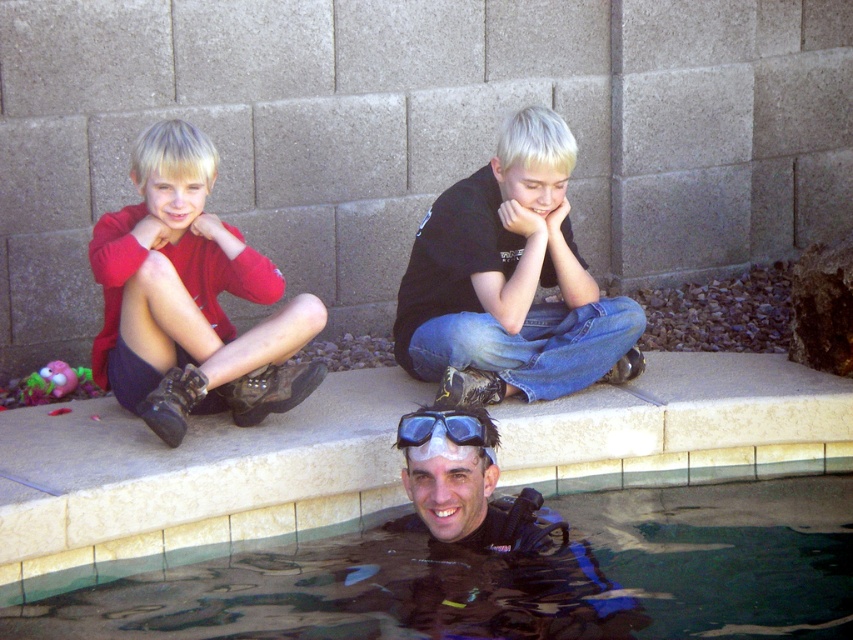
You are a photographer trying to capture the clear glass water at lower center and the black matte shirt at center in the same frame. Which object will appear larger in your photo?

The clear glass water at lower center will appear larger in the photo because it is bigger than the black matte shirt at center.

You are standing at the edge of the pool and want to place a floating toy in the clear glass water at lower center. According to the coordinates provided, where exactly should you place it?

The clear glass water at lower center is located at point [514,577], so you should place the floating toy there.

You are standing at point [509,118] and want to move to the poolside area where the scuba diver is. Is the point [734,493] behind you or in front of you?

Point [734,493] is behind point [509,118], so it is behind you.